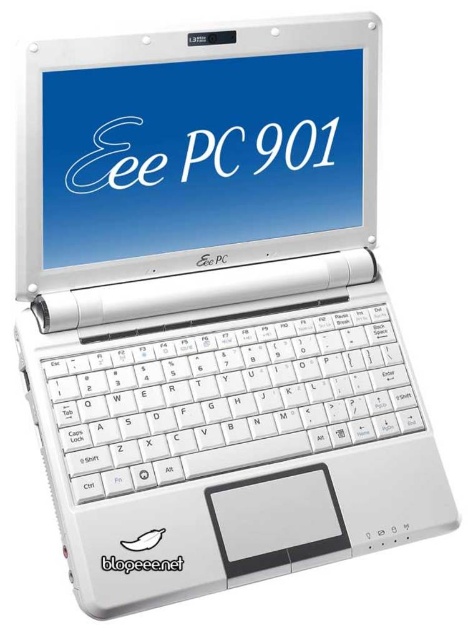
From the picture: Is matte white screen at center positioned in front of white plastic keyboard at center?

No, matte white screen at center is behind white plastic keyboard at center.

From the picture: Between matte white screen at center and white plastic keyboard at center, which one appears on the right side from the viewer's perspective?

white plastic keyboard at center is more to the right.

Between point (130, 200) and point (206, 400), which one is positioned in front?

Point (206, 400)

Locate an element on the screen. Image resolution: width=468 pixels, height=640 pixels. matte white screen at center is located at coordinates (198, 154).